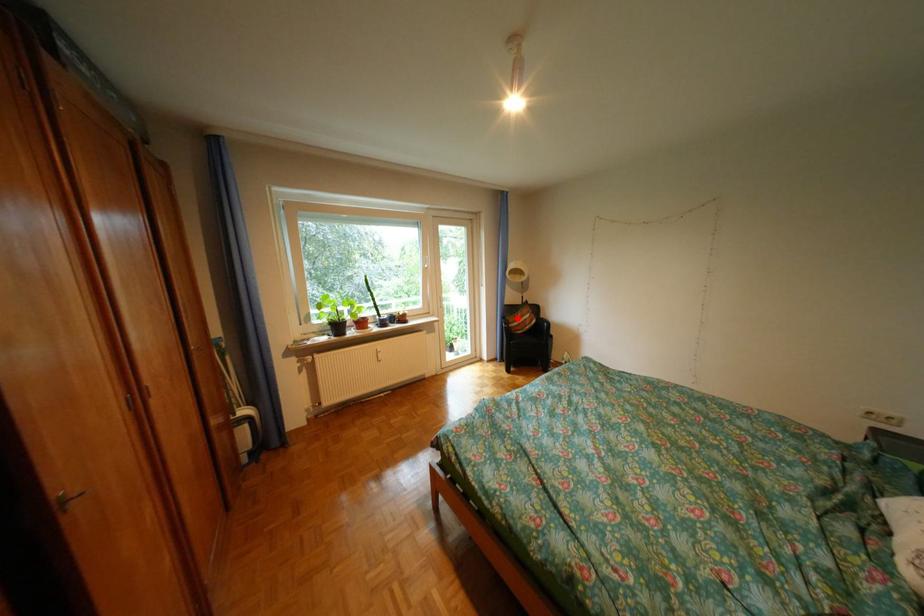
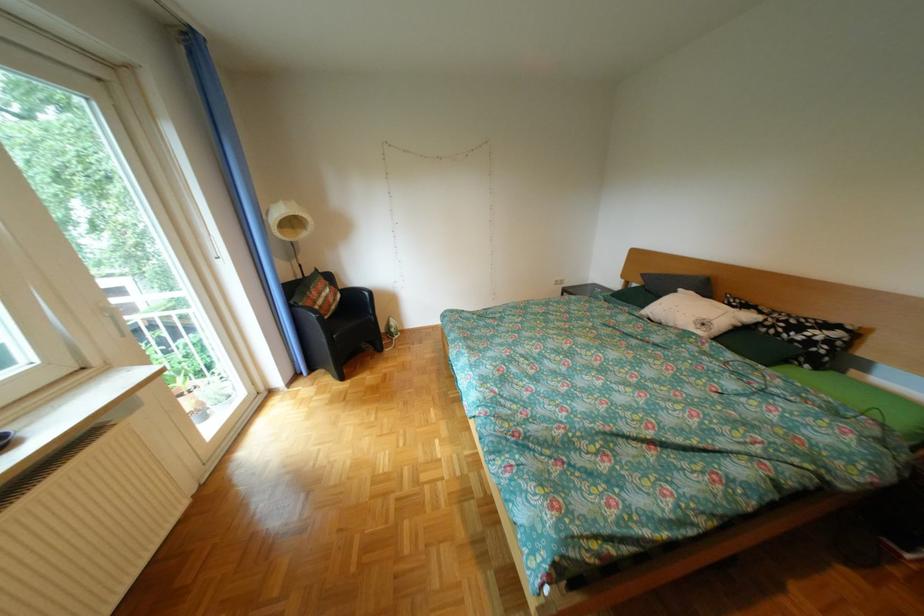
Question: I am providing you with two images of the same scene from different viewpoints. A red point is marked on the first image. Is the red point's position out of view in image 2?

Choices:
 (A) Yes
 (B) No

Answer: (B)